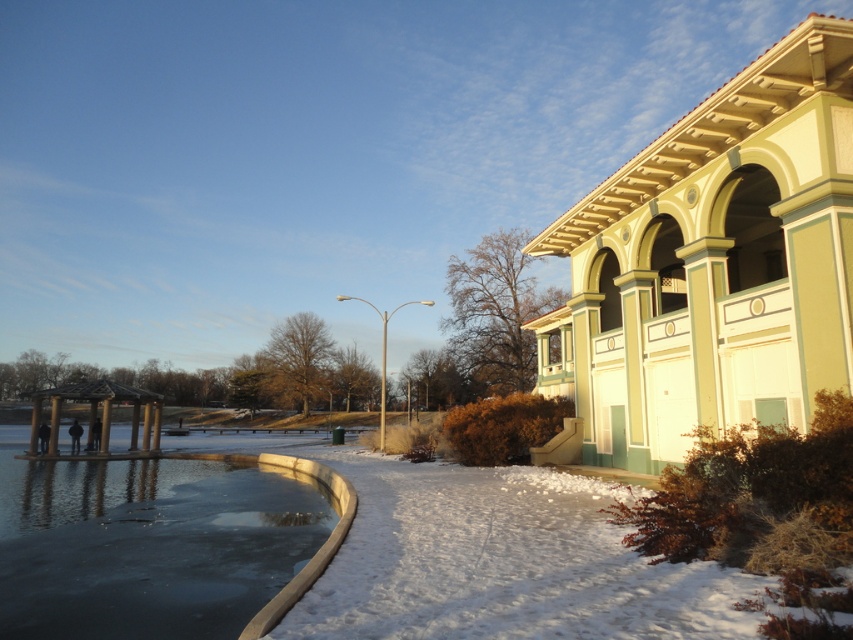
Can you confirm if white fluffy snow at lower center is positioned above smooth concrete lake at lower left?

Yes, white fluffy snow at lower center is above smooth concrete lake at lower left.

Which is below, white fluffy snow at lower center or smooth concrete lake at lower left?

Positioned lower is smooth concrete lake at lower left.

Describe the element at coordinates (502, 561) in the screenshot. Image resolution: width=853 pixels, height=640 pixels. I see `white fluffy snow at lower center` at that location.

This screenshot has height=640, width=853. Find the location of `white fluffy snow at lower center`. white fluffy snow at lower center is located at coordinates (x=502, y=561).